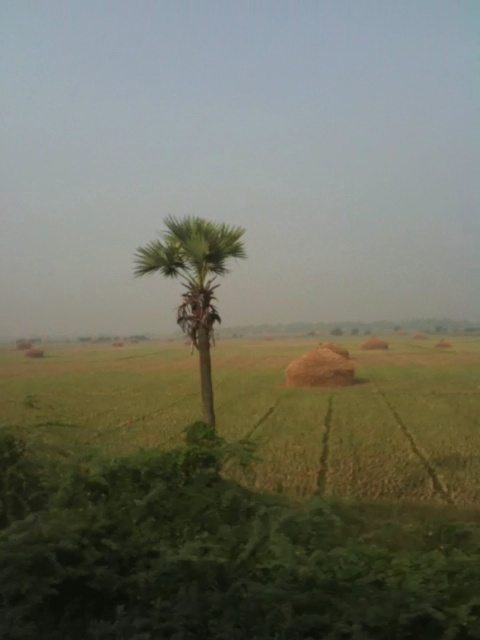
You are a farmer planning to plant crops in the green grassy field at center. You notice the green leafy vegetation at lower center nearby. Which area has more space available for planting?

The green grassy field at center has more space available for planting because it occupies more area than the green leafy vegetation at lower center.

You are a hiker who wants to take a clear photo of the palm tree in the midground. To avoid the green leafy vegetation at lower center and green grassy field at center from blocking the view, which object should you move closer to and which should you move away from?

The green leafy vegetation at lower center is shorter than green grassy field at center. To avoid obstruction, move closer to the green leafy vegetation at lower center and move away from the green grassy field at center since the shorter vegetation is less likely to block the view while the taller field might require more distance.

You are a photographer standing in the rural landscape. You want to capture a photo that includes both the green grassy field at center and the green leafy palm at center. Based on their positions, which object should appear closer to the bottom of the photo?

The green grassy field at center is below the green leafy palm at center, so it will appear closer to the bottom of the photo.